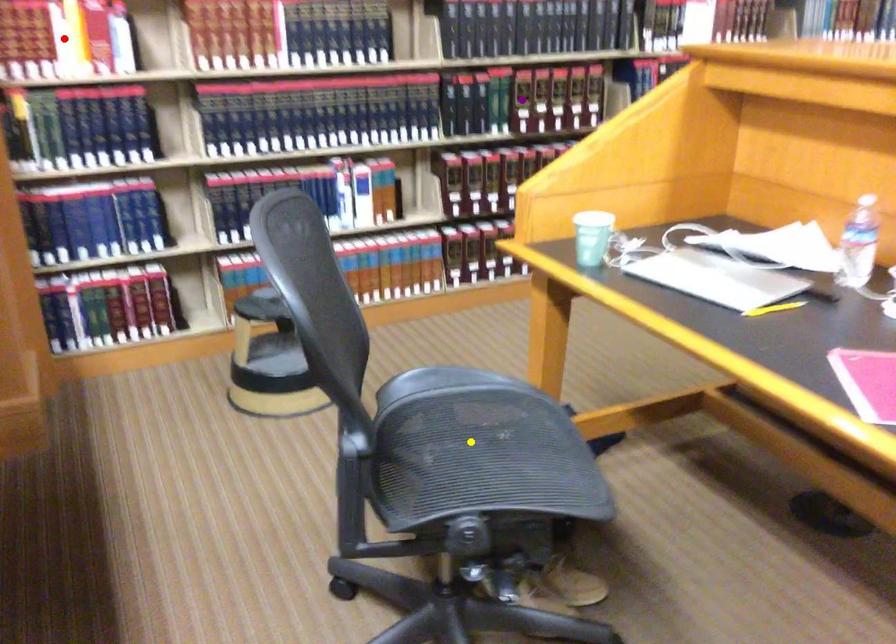
Order these from nearest to farthest:
purple point, red point, yellow point

yellow point < red point < purple point